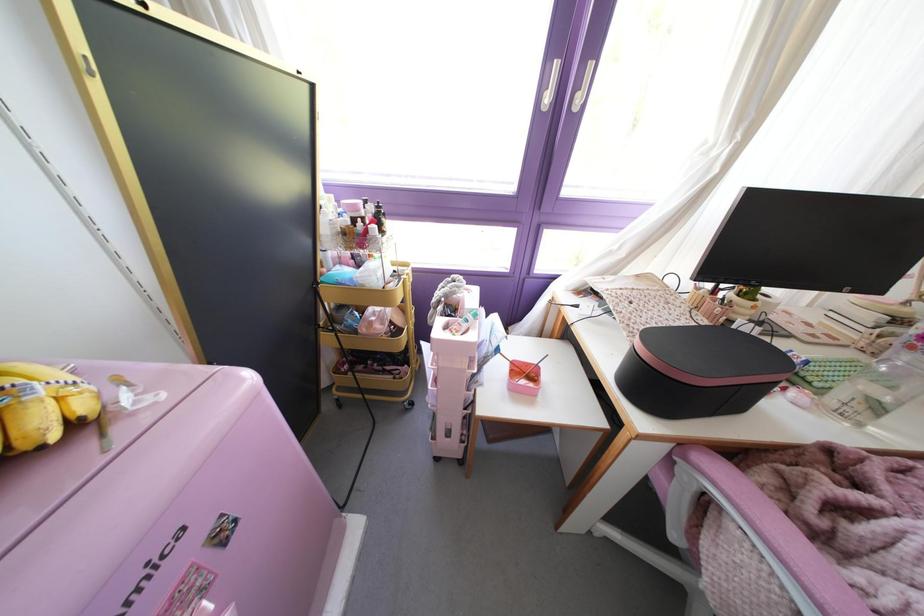
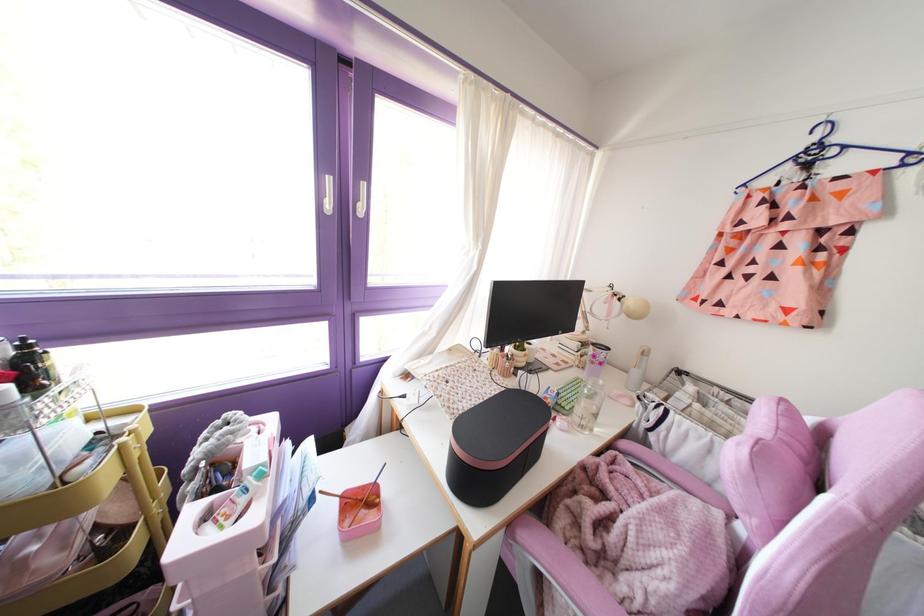
Locate, in the second image, the point that corresponds to point 843,541 in the first image.

(610, 553)